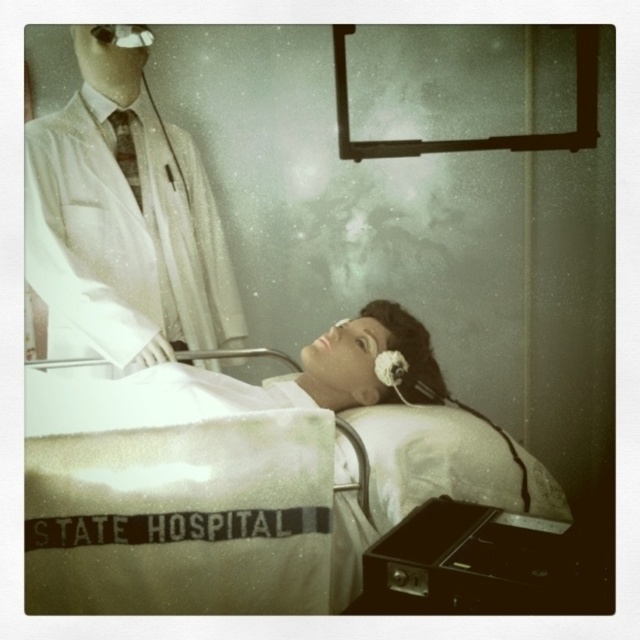
You are a nurse in a hospital room. You need to place a medical chart on the surface of the white matte lab coat at upper left and the white cotton hospital bed at center. Which surface has enough space to accommodate the chart without folding it?

The white cotton hospital bed at center has a greater width than the white matte lab coat at upper left, so the chart can be placed on the white cotton hospital bed at center without folding.

You are a nurse in the hospital room. You need to place a small medical kit on the nearest point to the camera between point [120,241] and point [145,387]. Which point should you choose?

Point [120,241] is further to the camera than point [145,387], so you should place the medical kit on point [120,241] because it is closer to you.

You are a patient in the hospital room and want to grab your medication from the bedside table. However, there is a white matte lab coat at upper left and a white cotton hospital bed at center in your way. Which object is taller so you need to duck under it?

The white matte lab coat at upper left is much taller than the white cotton hospital bed at center, so you need to duck under the white matte lab coat at upper left.